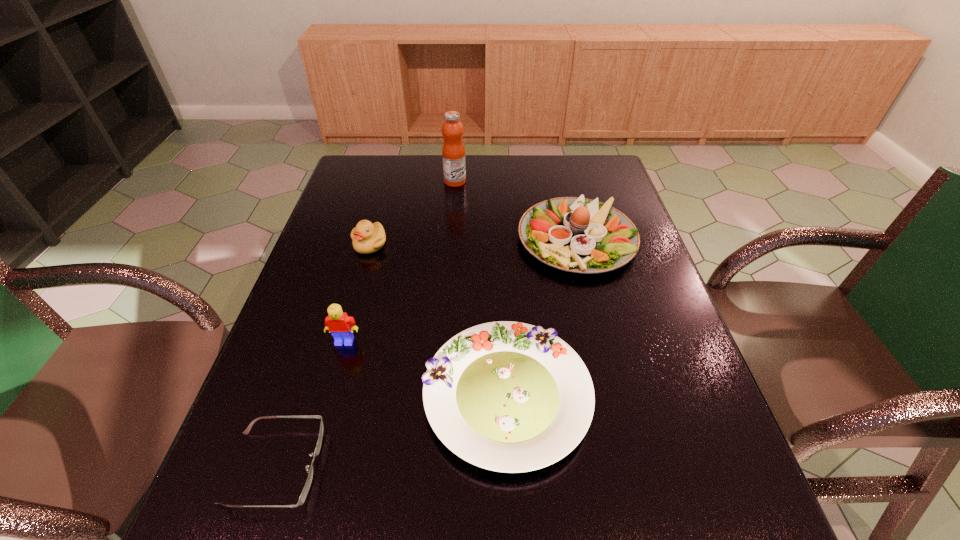
You are a GUI agent. You are given a task and a screenshot of the screen. Output one action in this format:
    pyautogui.click(x=<x>, y=<y>)
    Task: Click on the blank space located on the back of the taller salad plate
    
    Given the screenshot: What is the action you would take?
    pyautogui.click(x=564, y=185)

Locate an element on the screen. The image size is (960, 540). free location located on the beak of the third shortest object is located at coordinates point(350,315).

The width and height of the screenshot is (960, 540). Find the location of `vacant region located 0.090m on the front of the second shortest object`. vacant region located 0.090m on the front of the second shortest object is located at coordinates (514, 539).

I want to click on free space located 0.110m on the front-facing side of the shortest object, so click(x=381, y=467).

Find the location of a particular element. The image size is (960, 540). object at the far edge is located at coordinates (453, 151).

Where is `object situated at the near edge`? object situated at the near edge is located at coordinates (306, 488).

Find the location of `Lego located at the left edge`. Lego located at the left edge is located at coordinates (340, 325).

The height and width of the screenshot is (540, 960). Find the location of `duckling that is positioned at the left edge`. duckling that is positioned at the left edge is located at coordinates (367, 238).

Image resolution: width=960 pixels, height=540 pixels. I want to click on spectacles located at the left edge, so click(x=306, y=488).

Locate an element on the screen. Image resolution: width=960 pixels, height=540 pixels. object that is positioned at the right edge is located at coordinates (580, 235).